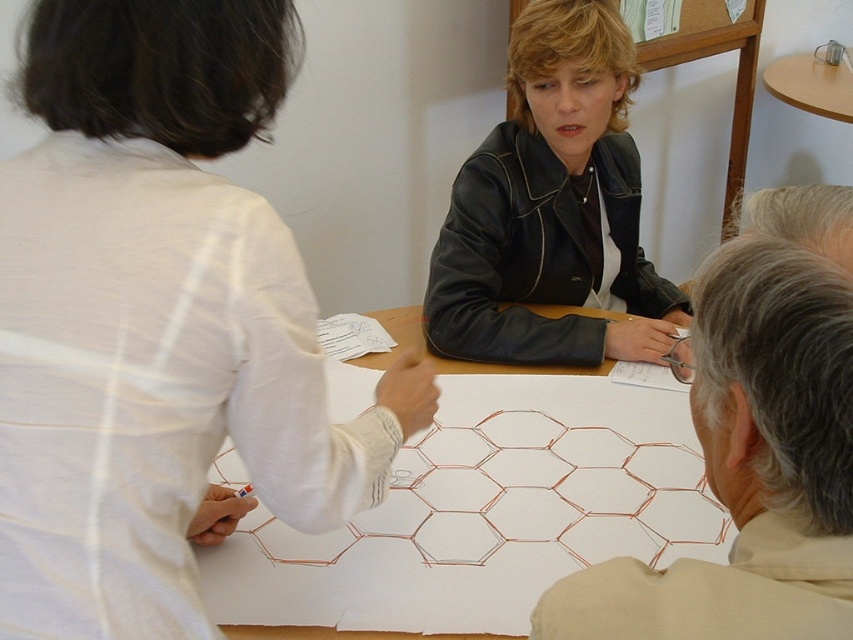
What is the position of the white fabric shirt at upper left relative to the point with coordinates (x=158, y=323)?

The point with coordinates (x=158, y=323) indicates the white fabric shirt at upper left, so they are in the same location.

What are the coordinates of the white paper at center?

The white paper at center is located at coordinates point (482, 516).

Based on the scene description, which object is wider, the white paper at center or the gray hair at upper right?

The white paper at center is wider than the gray hair at upper right.